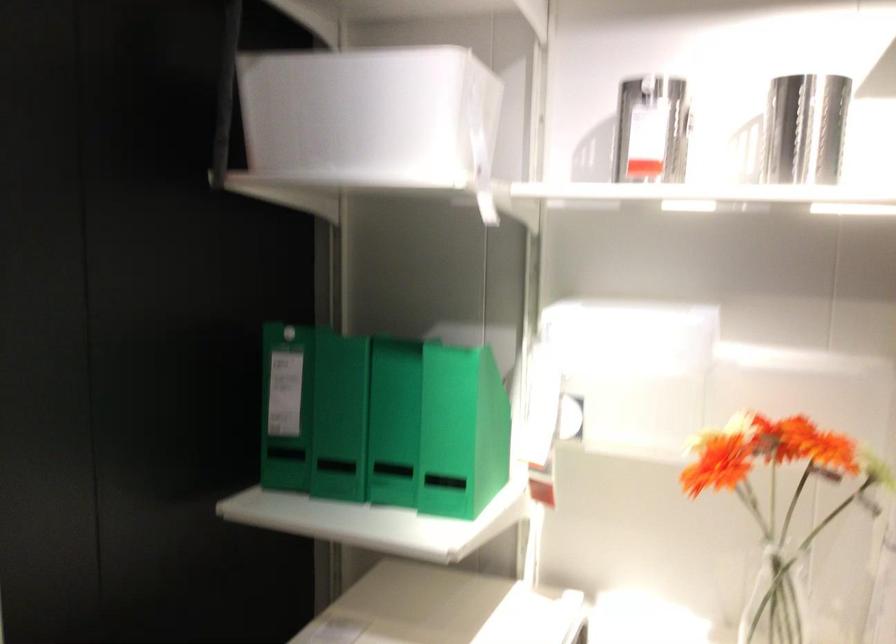
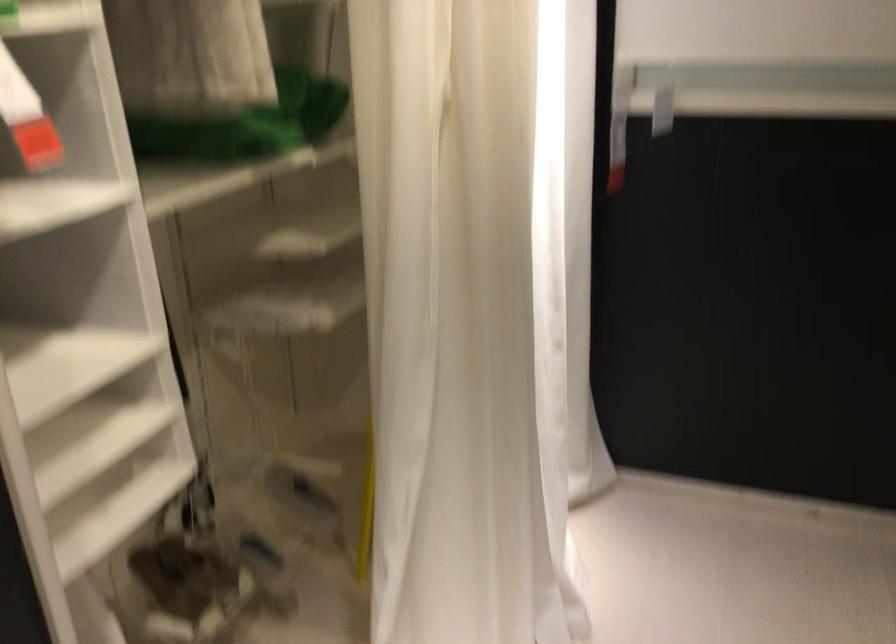
The first image is from the beginning of the video and the second image is from the end. How did the camera likely rotate when shooting the video?

The rotation direction of the camera is right-down.